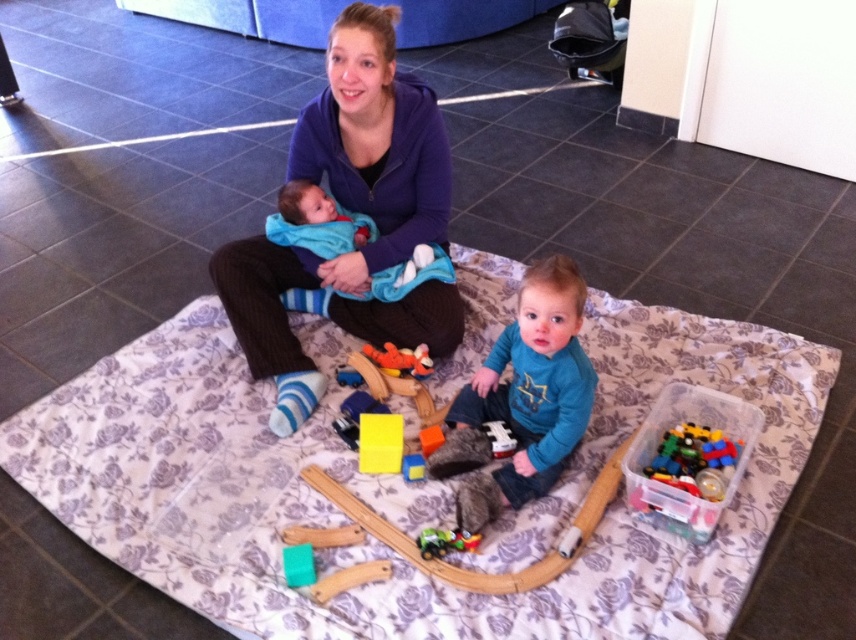
Question: Is teal soft fabric shirt at center to the left of wooden block at center from the viewer's perspective?

Choices:
 (A) no
 (B) yes

Answer: (A)

Question: Which is nearer to the teal soft fabric shirt at center?

Choices:
 (A) green plastic toy car at center
 (B) purple fleece jacket at upper center
 (C) wooden block at center

Answer: (C)

Question: Among these points, which one is nearest to the camera?

Choices:
 (A) (522, 477)
 (B) (688, 490)
 (C) (352, 484)

Answer: (B)

Question: Where is matte orange toy at center located in relation to green plastic toy car at center in the image?

Choices:
 (A) left
 (B) right

Answer: (A)

Question: Which object is the closest to the translucent plastic container at lower right?

Choices:
 (A) green plastic toy car at center
 (B) purple fleece jacket at upper center

Answer: (A)

Question: Does purple fleece jacket at upper center appear over teal soft fabric shirt at center?

Choices:
 (A) yes
 (B) no

Answer: (A)